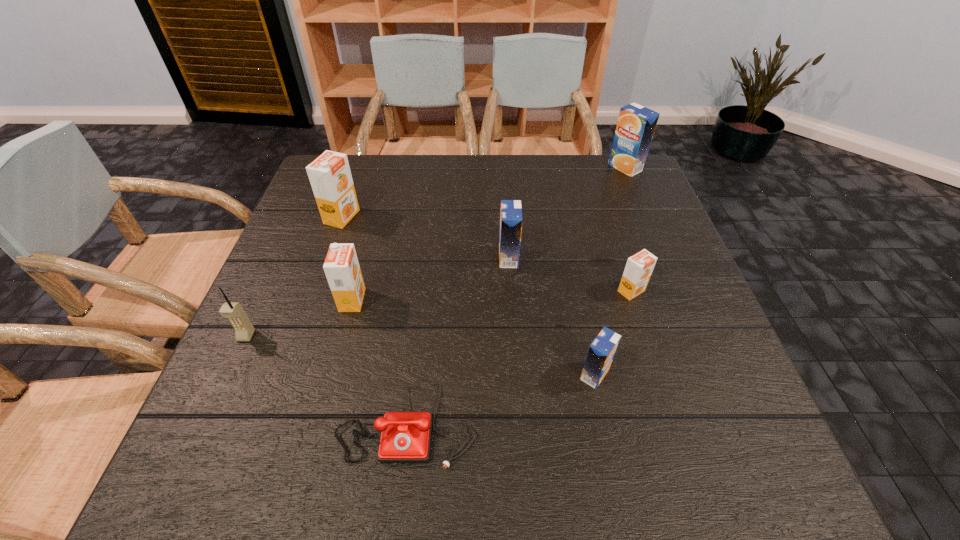
Identify the location of vacant space located 0.350m on the front of the third object from left to right. (303, 483).

The image size is (960, 540). I want to click on free point located on the back of the third orange juice from right to left, so click(576, 282).

Identify the location of free space located 0.090m on the front of the second object from right to left. [645, 334].

This screenshot has width=960, height=540. Identify the location of object that is at the far edge. (636, 124).

Where is `object located at the near edge`? The height and width of the screenshot is (540, 960). object located at the near edge is located at coordinates (405, 437).

Where is `orange juice that is at the left edge`? This screenshot has width=960, height=540. orange juice that is at the left edge is located at coordinates (329, 174).

Find the location of a particular element. cellular telephone positioned at the left edge is located at coordinates (244, 329).

This screenshot has width=960, height=540. Identify the location of object present at the far right corner. (636, 124).

Image resolution: width=960 pixels, height=540 pixels. In the image, there is a desktop. Identify the location of vacant space at the far edge. (516, 154).

Identify the location of free region at the near edge of the desktop. (648, 441).